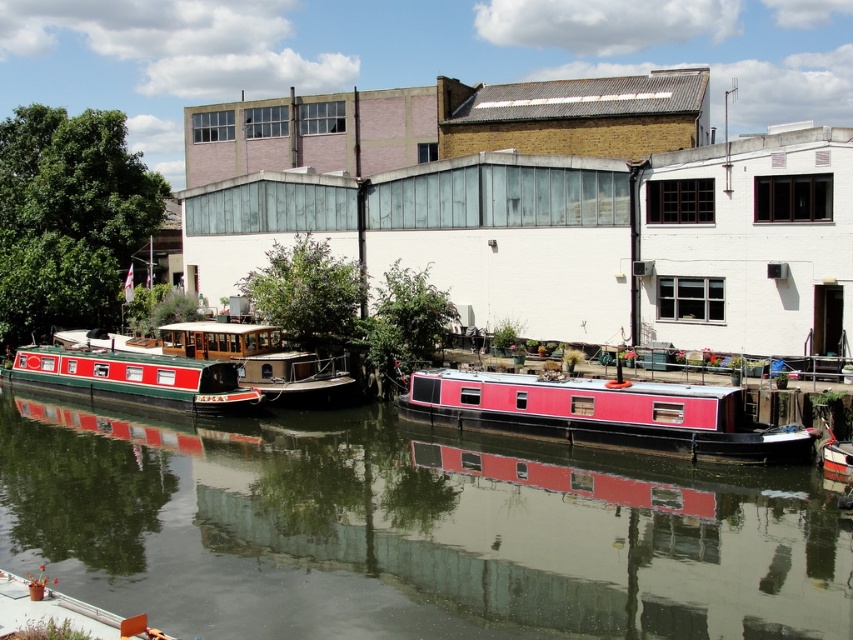
Question: Which object is the closest to the red polished wood barge at center?

Choices:
 (A) matte red barge at center
 (B) red glossy barge at left

Answer: (B)

Question: Which object is the closest to the red glossy barge at left?

Choices:
 (A) smooth water at center
 (B) matte red barge at center
 (C) red polished wood barge at center

Answer: (C)

Question: Is smooth water at center bigger than red glossy barge at left?

Choices:
 (A) yes
 (B) no

Answer: (A)

Question: Based on their relative distances, which object is nearer to the red polished wood barge at center?

Choices:
 (A) smooth water at center
 (B) matte red barge at center
 (C) red glossy barge at left

Answer: (C)

Question: Does smooth water at center come behind red glossy barge at left?

Choices:
 (A) yes
 (B) no

Answer: (B)

Question: From the image, what is the correct spatial relationship of red glossy barge at left in relation to red polished wood barge at center?

Choices:
 (A) right
 (B) left

Answer: (B)